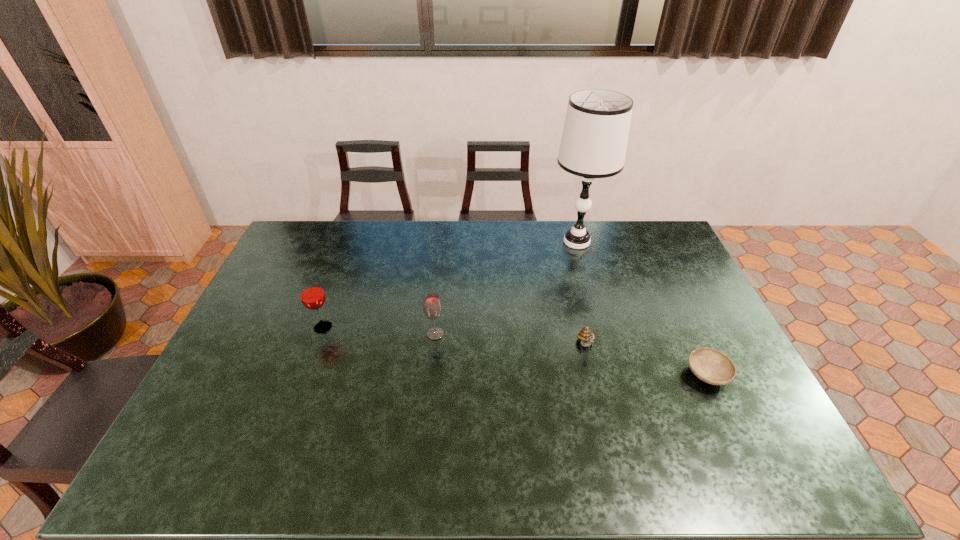
This screenshot has height=540, width=960. In order to click on vacant space that satisfies the following two spatial constraints: 1. on the back side of the fourth object from right to left; 2. on the left side of the tallest object in this screenshot , I will do `click(444, 242)`.

Find the location of a particular element. The height and width of the screenshot is (540, 960). vacant space that satisfies the following two spatial constraints: 1. on the front side of the leftmost object; 2. on the right side of the rightmost object is located at coordinates (306, 375).

Identify the location of free space that satisfies the following two spatial constraints: 1. on the back side of the table lamp; 2. on the left side of the left glass drink container. (354, 242).

I want to click on free space in the image that satisfies the following two spatial constraints: 1. on the back side of the leftmost object; 2. on the right side of the farthest object, so click(x=354, y=242).